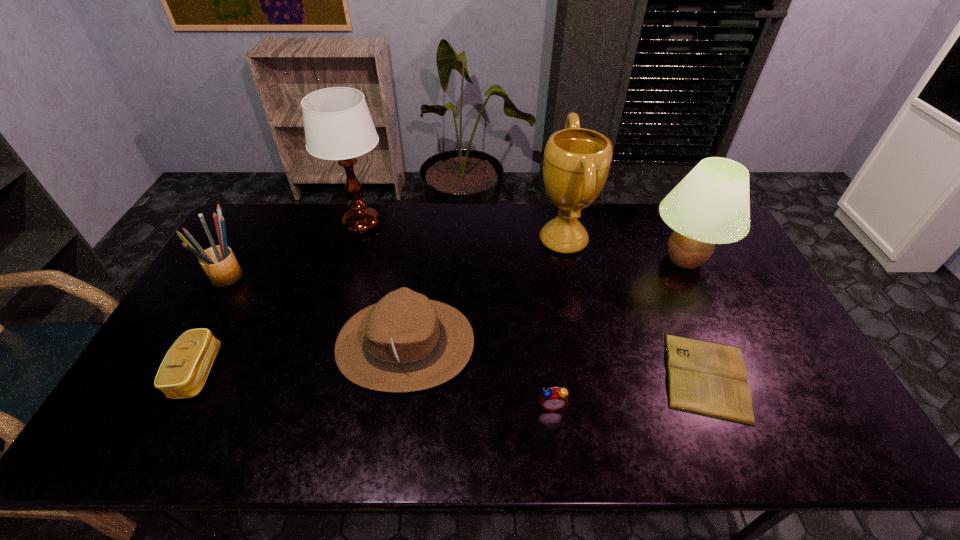
Locate an element on the screen. The image size is (960, 540). free space located on the front of the award with the decoration is located at coordinates (422, 240).

In order to click on vacant space located on the front of the award with the decoration in this screenshot , I will do `click(431, 240)`.

Identify the location of free space located on the shade of the lampshade. The height and width of the screenshot is (540, 960). (740, 373).

The image size is (960, 540). Identify the location of free space located on the front of the pencil box. (206, 317).

Locate an element on the screen. This screenshot has width=960, height=540. blank space located on the feather side of the fedora is located at coordinates (589, 344).

Where is `vacant region located 0.260m on the zipper side of the clutch bag`? The height and width of the screenshot is (540, 960). vacant region located 0.260m on the zipper side of the clutch bag is located at coordinates (316, 372).

Locate an element on the screen. Image resolution: width=960 pixels, height=540 pixels. vacant area situated on the back of the book is located at coordinates (660, 266).

I want to click on table lamp that is at the far edge, so click(x=338, y=126).

This screenshot has height=540, width=960. In order to click on award positioned at the far edge in this screenshot , I will do `click(577, 161)`.

Locate an element on the screen. Image resolution: width=960 pixels, height=540 pixels. lampshade present at the far edge is located at coordinates (711, 205).